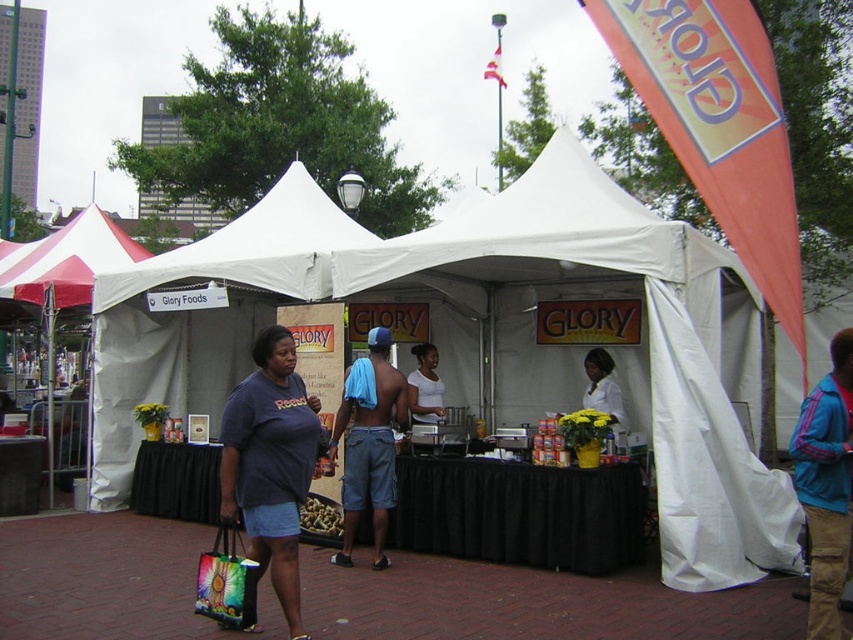
Question: Which of the following is the farthest from the observer?

Choices:
 (A) (416, 388)
 (B) (560, 170)

Answer: (A)

Question: Can you confirm if matte blue t-shirt at center is positioned below white matte shirt at center?

Choices:
 (A) no
 (B) yes

Answer: (B)

Question: Which point is farther to the camera?

Choices:
 (A) (367, 365)
 (B) (312, 520)
 (C) (409, 381)

Answer: (C)

Question: Does matte blue t-shirt at center have a smaller size compared to white fabric shirt at center?

Choices:
 (A) no
 (B) yes

Answer: (A)

Question: Where is blue fleece jacket at lower right located in relation to white fabric shirt at center in the image?

Choices:
 (A) below
 (B) above

Answer: (A)

Question: Which is farther from the white fabric shirt at center?

Choices:
 (A) orange fabric canopy at upper center
 (B) blue fleece jacket at lower right
 (C) white fabric tent at center

Answer: (A)